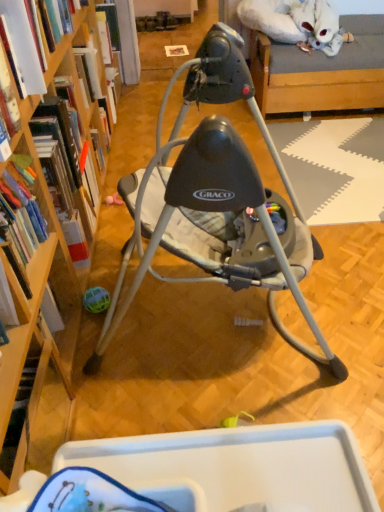
Question: From a real-world perspective, is hardcover book at upper left, the fourth book from the bottom, positioned above or below hardcover book at left, which appears as the 3th book when viewed from the top?

Choices:
 (A) below
 (B) above

Answer: (A)

Question: Is point (110, 10) closer or farther from the camera than point (66, 109)?

Choices:
 (A) closer
 (B) farther

Answer: (B)

Question: Estimate the real-world distances between objects in this image. Which object is closer to the hardcover book at left, which is the 2th book in front-to-back order?

Choices:
 (A) hardcover book at upper left, the first book when ordered from top to bottom
 (B) hardcover book at left, positioned as the 2th book in back-to-front order
 (C) hardcover book at left, placed as the 4th book when sorted from back to front
 (D) matte gray baby swing at center

Answer: (B)

Question: Which object is positioned farthest from the hardcover book at left, arranged as the 2th book when ordered from the bottom?

Choices:
 (A) matte gray baby swing at center
 (B) hardcover book at left, the fourth book positioned from the top
 (C) hardcover book at left, which is the second book in top-to-bottom order
 (D) hardcover book at upper left, the first book when ordered from top to bottom

Answer: (D)